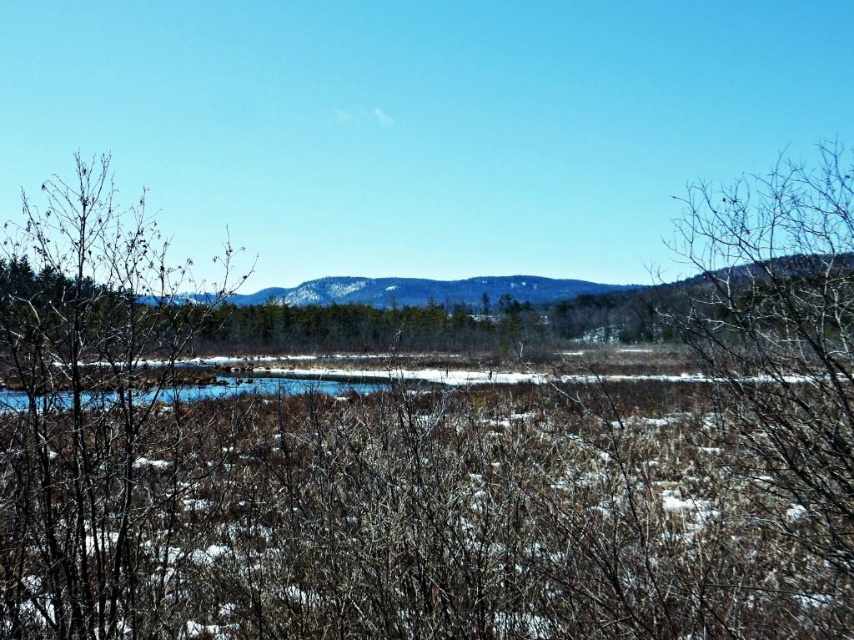
Who is shorter, bare branches at left or brown textured branches at right?

With less height is brown textured branches at right.

Does bare branches at left have a smaller size compared to brown textured branches at right?

Incorrect, bare branches at left is not smaller in size than brown textured branches at right.

Who is more distant from viewer, (145, 563) or (732, 208)?

Point (145, 563)

At what (x,y) coordinates should I click in order to perform the action: click on bare branches at left. Please return your answer as a coordinate pair (x, y). The image size is (854, 640). Looking at the image, I should click on pyautogui.click(x=89, y=412).